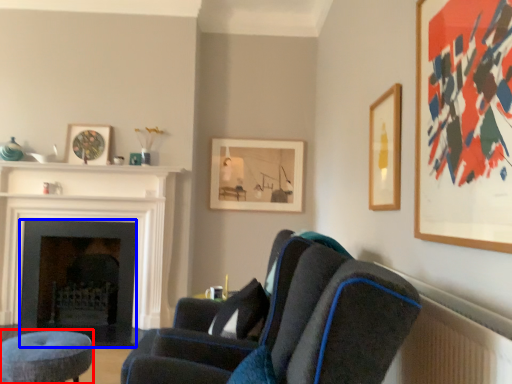
Question: Which object appears closest to the camera in this image, stool (highlighted by a red box) or fireplace (highlighted by a blue box)?

Choices:
 (A) stool
 (B) fireplace

Answer: (A)